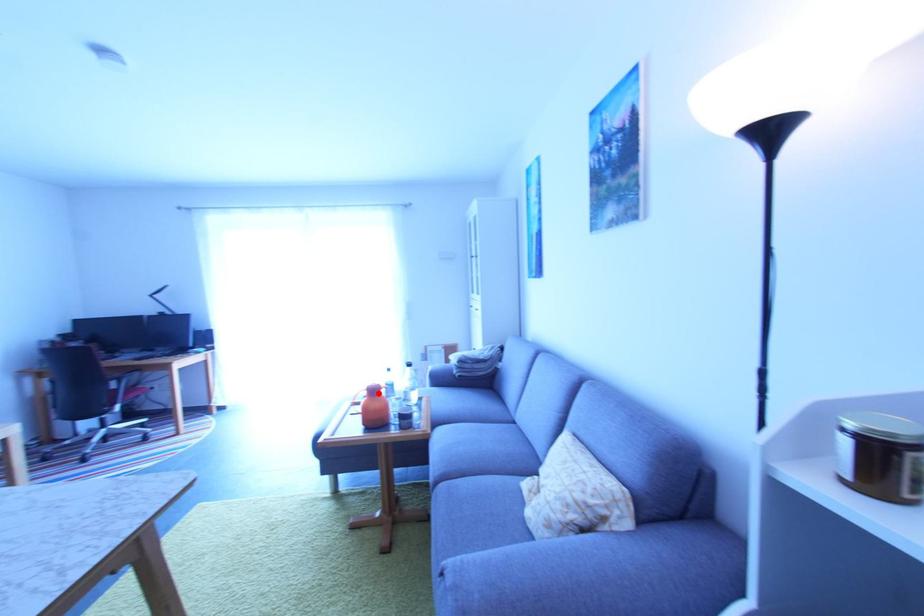
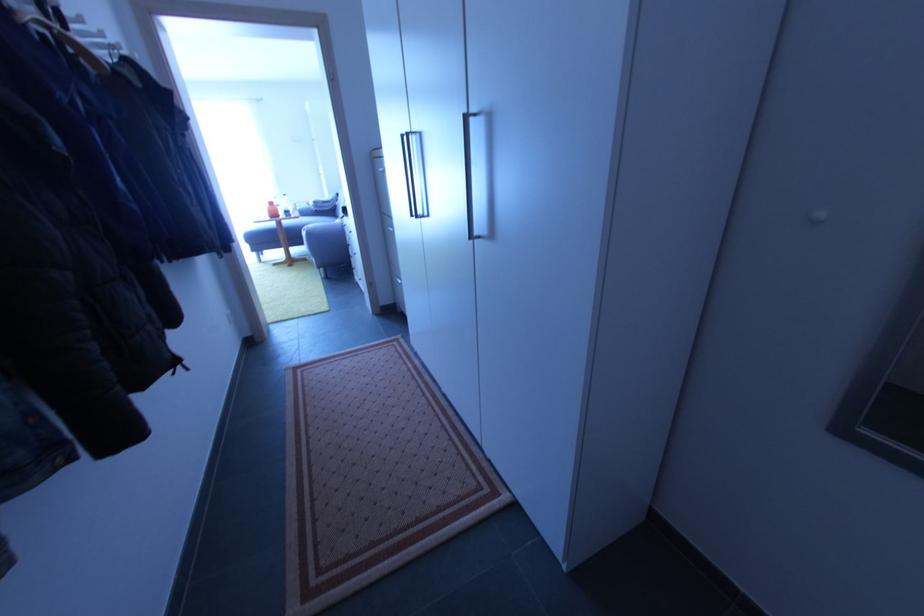
Question: I am providing you with two images of the same scene from different viewpoints. Image1 has a red point marked. In image2, the corresponding 3D location appears at what relative position? Reply with the corresponding letter.

Choices:
 (A) Closer
 (B) Farther

Answer: (A)